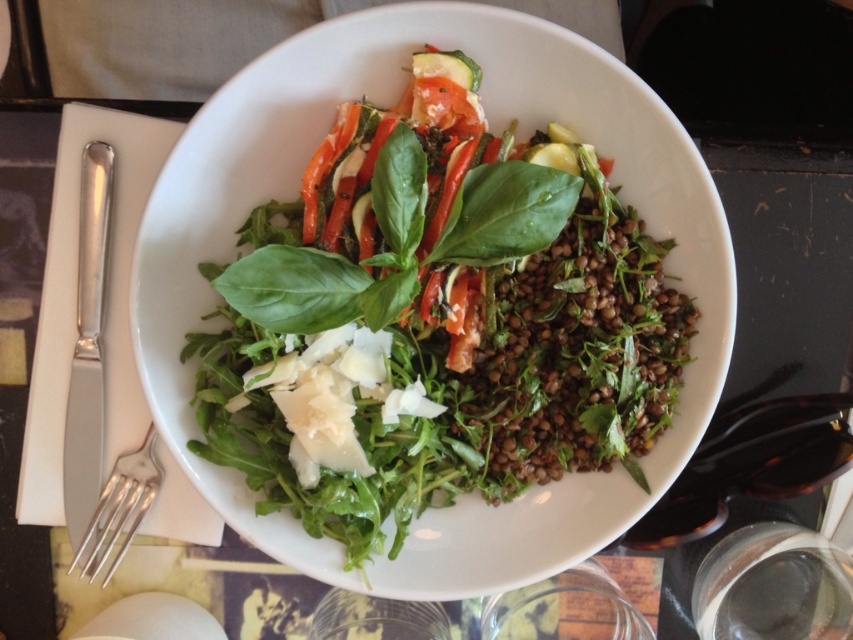
Question: Does satin finish knife at left appear on the right side of satin silver fork at lower left?

Choices:
 (A) no
 (B) yes

Answer: (A)

Question: Which object is positioned closest to the satin silver fork at lower left?

Choices:
 (A) green leafy salad at center
 (B) satin finish knife at left

Answer: (B)

Question: Which object is the farthest from the green leafy salad at center?

Choices:
 (A) satin silver fork at lower left
 (B) satin finish knife at left

Answer: (A)

Question: Which is farther from the satin finish knife at left?

Choices:
 (A) green leafy salad at center
 (B) satin silver fork at lower left

Answer: (A)

Question: Is green leafy salad at center smaller than satin finish knife at left?

Choices:
 (A) yes
 (B) no

Answer: (B)

Question: Does satin finish knife at left appear under satin silver fork at lower left?

Choices:
 (A) no
 (B) yes

Answer: (A)